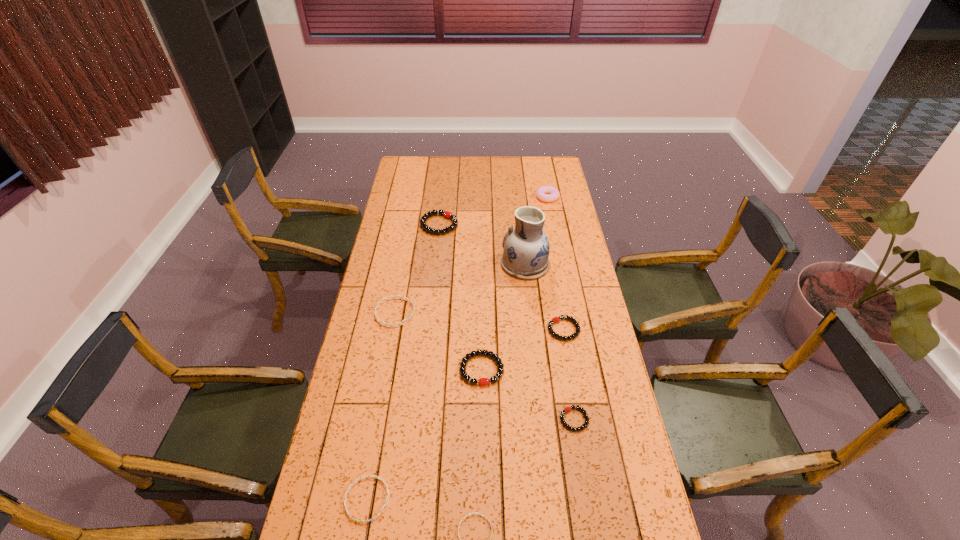
This screenshot has width=960, height=540. I want to click on free spot between the farthest blue bracelet and the third nearest black bracelet, so click(479, 321).

Identify the location of vacant space that is in between the farthest blue bracelet and the second tallest object. (470, 255).

You are a GUI agent. You are given a task and a screenshot of the screen. Output one action in this format:
    pyautogui.click(x=<x>, y=<y>)
    Task: Click on the fifth closest object to the second farthest black bracelet
    
    Given the screenshot: What is the action you would take?
    pyautogui.click(x=447, y=214)

You are a GUI agent. You are given a task and a screenshot of the screen. Output one action in this format:
    pyautogui.click(x=<x>, y=<y>)
    Task: Click on the object that stands as the fifth closest to the third black bracelet from right to left
    
    Given the screenshot: What is the action you would take?
    pyautogui.click(x=526, y=247)

Find the location of a particular element. The width and height of the screenshot is (960, 540). bracelet that is the sixth closest to the farthest object is located at coordinates (365, 476).

You are a GUI agent. You are given a task and a screenshot of the screen. Output one action in this format:
    pyautogui.click(x=<x>, y=<y>)
    Task: Click on the bracelet that can be found as the fourth closest to the farthest blue bracelet
    
    Given the screenshot: What is the action you would take?
    pyautogui.click(x=365, y=476)

Image resolution: width=960 pixels, height=540 pixels. In order to click on black bracelet identified as the third closest to the farthest blue bracelet in this screenshot , I will do `click(556, 319)`.

Identify the location of black bracelet that is the closest to the shortest object. The width and height of the screenshot is (960, 540). (567, 409).

Point out which blue bracelet is positioned as the second nearest to the shortest object. Please provide its 2D coordinates. Your answer should be formatted as a tuple, i.e. [(x, y)], where the tuple contains the x and y coordinates of a point satisfying the conditions above.

[(401, 297)]

Where is `blue bracelet that is the second closest to the second smallest blue bracelet`? blue bracelet that is the second closest to the second smallest blue bracelet is located at coordinates (401, 297).